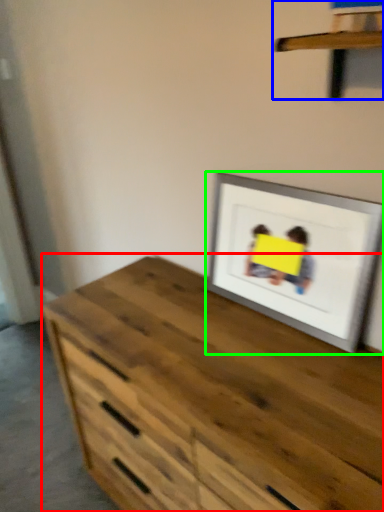
Question: Which object is positioned farthest from chest of drawers (highlighted by a red box)? Select from shelf (highlighted by a blue box) and picture frame (highlighted by a green box).

Choices:
 (A) shelf
 (B) picture frame

Answer: (A)